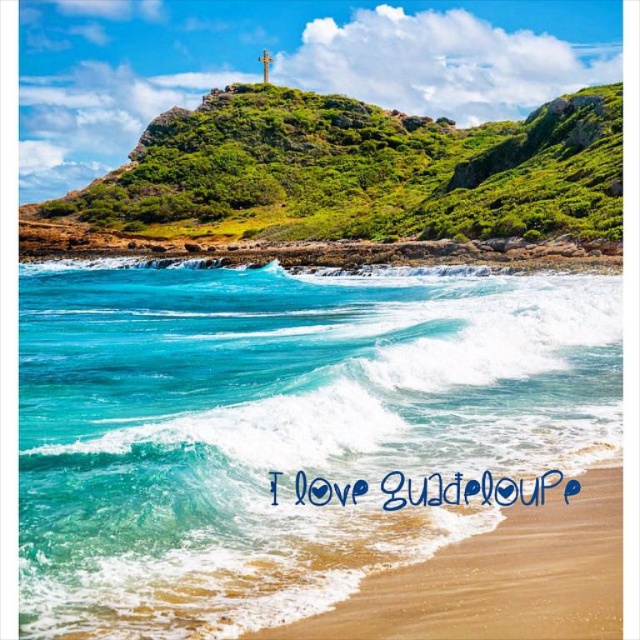
Question: Which point is farther from the camera taking this photo?

Choices:
 (A) (259, 413)
 (B) (612, 474)
 (C) (572, 138)

Answer: (C)

Question: Considering the relative positions of turquoise glossy water at lower left and sandy beach at lower right in the image provided, where is turquoise glossy water at lower left located with respect to sandy beach at lower right?

Choices:
 (A) above
 (B) below

Answer: (A)

Question: Which point is farther from the camera taking this photo?

Choices:
 (A) (477, 560)
 (B) (477, 435)

Answer: (B)

Question: Which point is farther to the camera?

Choices:
 (A) (385, 586)
 (B) (593, 198)

Answer: (B)

Question: Does turquoise glossy water at lower left lie behind sandy beach at lower right?

Choices:
 (A) no
 (B) yes

Answer: (B)

Question: Is turquoise glossy water at lower left to the left of sandy beach at lower right from the viewer's perspective?

Choices:
 (A) yes
 (B) no

Answer: (A)